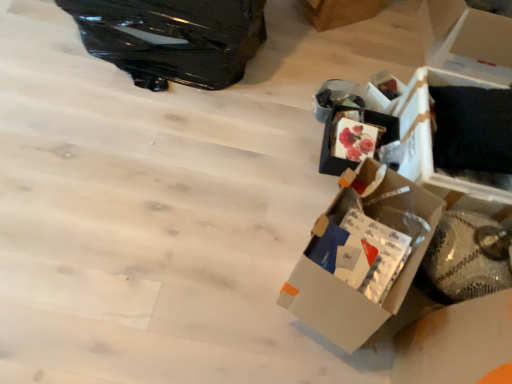
Question: Does white cardboard box at upper right, which is the first cardboard box from left to right, have a greater height compared to glossy black suitcase at upper left?

Choices:
 (A) no
 (B) yes

Answer: (A)

Question: From a real-world perspective, is white cardboard box at upper right, which is the first cardboard box from left to right, beneath glossy black suitcase at upper left?

Choices:
 (A) no
 (B) yes

Answer: (B)

Question: Considering the relative positions of white cardboard box at upper right, which is the first cardboard box from left to right, and glossy black suitcase at upper left in the image provided, is white cardboard box at upper right, which is the first cardboard box from left to right, to the left of glossy black suitcase at upper left from the viewer's perspective?

Choices:
 (A) no
 (B) yes

Answer: (A)

Question: Is white cardboard box at upper right, placed as the second cardboard box when sorted from right to left, aimed at glossy black suitcase at upper left?

Choices:
 (A) yes
 (B) no

Answer: (B)

Question: Is white cardboard box at upper right, placed as the second cardboard box when sorted from right to left, at the right side of glossy black suitcase at upper left?

Choices:
 (A) yes
 (B) no

Answer: (A)

Question: Is white cardboard box at upper right, placed as the second cardboard box when sorted from right to left, placed right next to glossy black suitcase at upper left?

Choices:
 (A) yes
 (B) no

Answer: (B)

Question: Does white cardboard box at upper right, which is the first cardboard box from left to right, have a lesser width compared to white cardboard box at center-right?

Choices:
 (A) yes
 (B) no

Answer: (B)

Question: Considering the relative positions of white cardboard box at upper right, which is the first cardboard box from left to right, and white cardboard box at center-right in the image provided, is white cardboard box at upper right, which is the first cardboard box from left to right, behind white cardboard box at center-right?

Choices:
 (A) yes
 (B) no

Answer: (A)

Question: Is white cardboard box at upper right, placed as the second cardboard box when sorted from right to left, positioned before white cardboard box at center-right?

Choices:
 (A) yes
 (B) no

Answer: (B)

Question: Is white cardboard box at upper right, placed as the second cardboard box when sorted from right to left, taller than white cardboard box at center-right?

Choices:
 (A) no
 (B) yes

Answer: (A)

Question: Does white cardboard box at upper right, placed as the second cardboard box when sorted from right to left, appear on the left side of white cardboard box at center-right?

Choices:
 (A) yes
 (B) no

Answer: (B)

Question: Is white cardboard box at upper right, which is the first cardboard box from left to right, shorter than white cardboard box at center-right?

Choices:
 (A) yes
 (B) no

Answer: (A)

Question: Considering the relative positions of black cardboard box at right, arranged as the 2th storage box when viewed from the back, and white cardboard box at upper right, arranged as the 1th storage box when viewed from the back, in the image provided, is black cardboard box at right, arranged as the 2th storage box when viewed from the back, to the left of white cardboard box at upper right, arranged as the 1th storage box when viewed from the back, from the viewer's perspective?

Choices:
 (A) yes
 (B) no

Answer: (B)